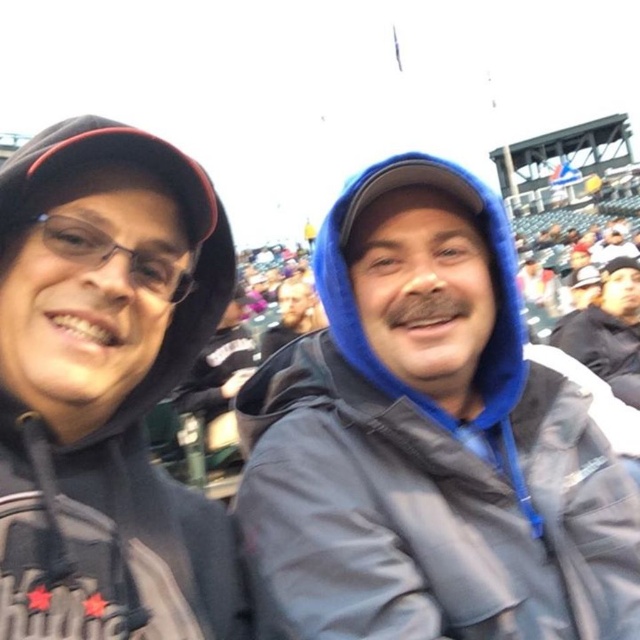
Does black matte hoodie at left have a lesser height compared to bearded man at center?

No.

Can you confirm if black matte hoodie at left is bigger than bearded man at center?

Yes, black matte hoodie at left is bigger than bearded man at center.

In order to click on black matte hoodie at left in this screenshot , I will do `click(113, 417)`.

Where is `black matte hoodie at left`? The height and width of the screenshot is (640, 640). black matte hoodie at left is located at coordinates (113, 417).

Which is behind, point (499, 484) or point (593, 324)?

Positioned behind is point (593, 324).

Is blue fleece jacket at center to the left of black matte jacket at right from the viewer's perspective?

Indeed, blue fleece jacket at center is positioned on the left side of black matte jacket at right.

Is point (284, 371) more distant than point (636, 353)?

No, it is in front of (636, 353).

Where is `blue fleece jacket at center`? This screenshot has width=640, height=640. blue fleece jacket at center is located at coordinates (429, 440).

Is black matte jacket at right below bearded man at center?

Indeed, black matte jacket at right is positioned under bearded man at center.

Is black matte jacket at right smaller than bearded man at center?

Yes, black matte jacket at right is smaller than bearded man at center.

Who is more forward, (580,362) or (285,337)?

Point (580,362)

The height and width of the screenshot is (640, 640). Find the location of `black matte jacket at right`. black matte jacket at right is located at coordinates (609, 330).